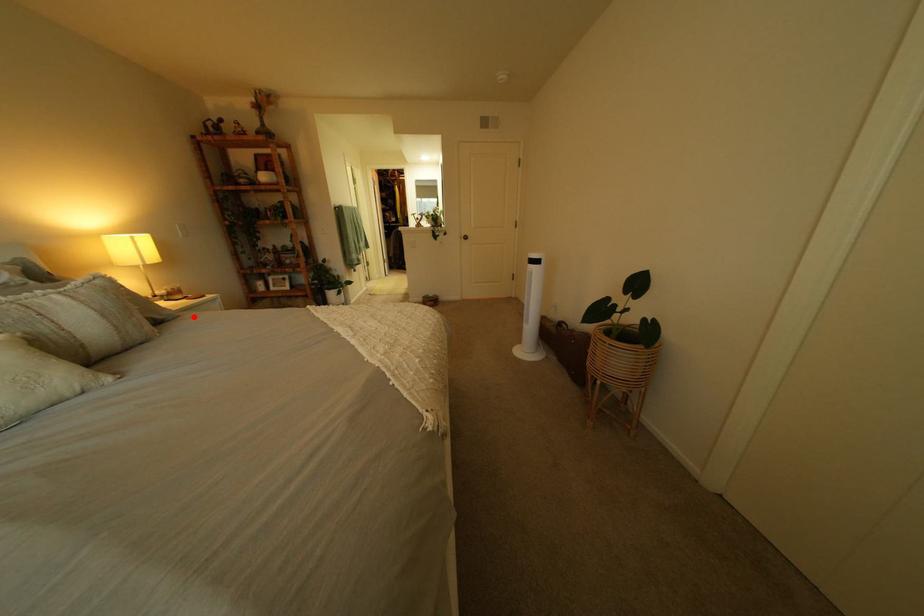
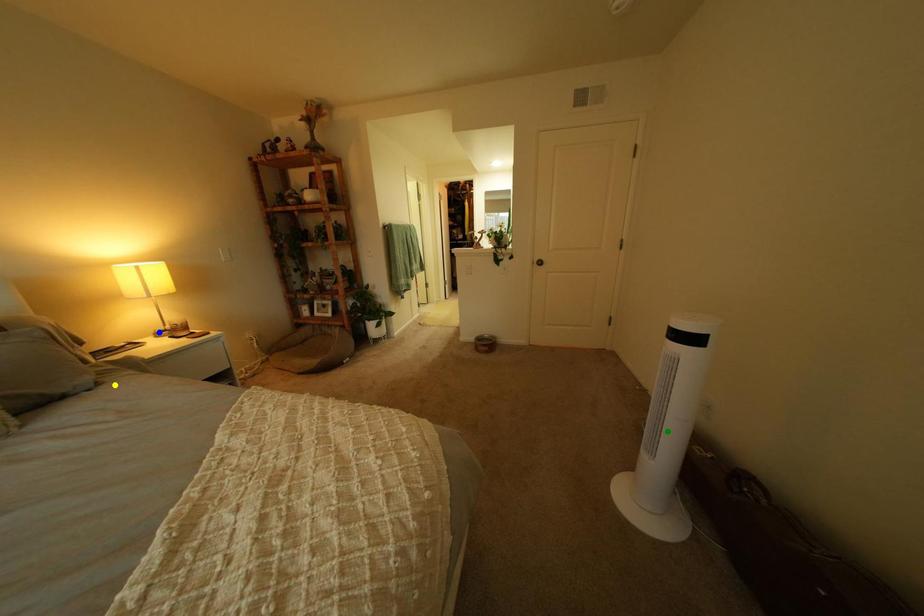
Question: I am providing you with two images of the same scene from different viewpoints. A red point is marked on the first image. You are given multiple points on the second image. Which point in image 2 represents the same 3d spot as the red point in image 1?

Choices:
 (A) blue point
 (B) green point
 (C) yellow point

Answer: (C)